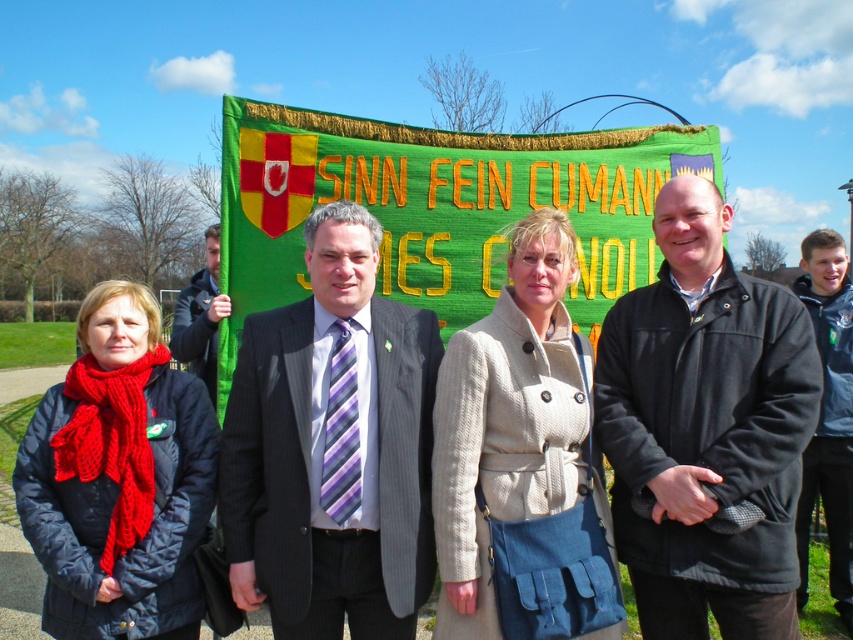
Question: Is black fleece jacket at center smaller than knitted red scarf at left?

Choices:
 (A) yes
 (B) no

Answer: (B)

Question: Among these objects, which one is nearest to the camera?

Choices:
 (A) blue fabric jacket at right
 (B) black fleece jacket at center

Answer: (B)

Question: Which point is closer to the camera taking this photo?

Choices:
 (A) (80, 337)
 (B) (496, 579)

Answer: (B)

Question: Among these points, which one is nearest to the camera?

Choices:
 (A) (540, 314)
 (B) (210, 349)

Answer: (A)

Question: Is knitted red scarf at left bigger than blue fabric jacket at right?

Choices:
 (A) no
 (B) yes

Answer: (A)

Question: Where is beige woolen coat at center located in relation to dark gray jacket at center in the image?

Choices:
 (A) left
 (B) right

Answer: (B)